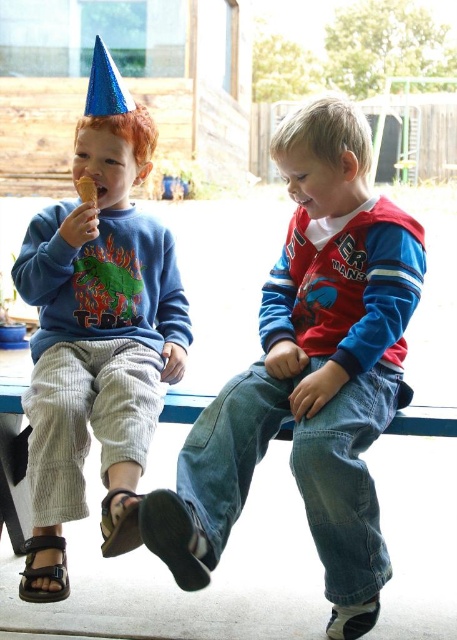
Can you confirm if denim jeans at center is positioned below black leather sandal at lower left?

No.

Does denim jeans at center come in front of black leather sandal at lower left?

Yes, denim jeans at center is closer to the viewer.

Who is more forward, (327, 262) or (22, 586)?

Positioned in front is point (22, 586).

Locate an element on the screen. denim jeans at center is located at coordinates (309, 372).

Can you confirm if brown leather sandal at lower left is positioned above black leather sandal at lower left?

Correct, brown leather sandal at lower left is located above black leather sandal at lower left.

Does brown leather sandal at lower left appear on the right side of black leather sandal at lower left?

Indeed, brown leather sandal at lower left is positioned on the right side of black leather sandal at lower left.

Between point (106, 529) and point (31, 547), which one is positioned in front?

Positioned in front is point (106, 529).

Identify the location of brown leather sandal at lower left. The image size is (457, 640). (120, 522).

Is point (356, 552) more distant than point (122, 310)?

No, it is in front of (122, 310).

Which is in front, point (244, 493) or point (85, 116)?

Positioned in front is point (244, 493).

Where is `denim jeans at center`? This screenshot has width=457, height=640. denim jeans at center is located at coordinates (309, 372).